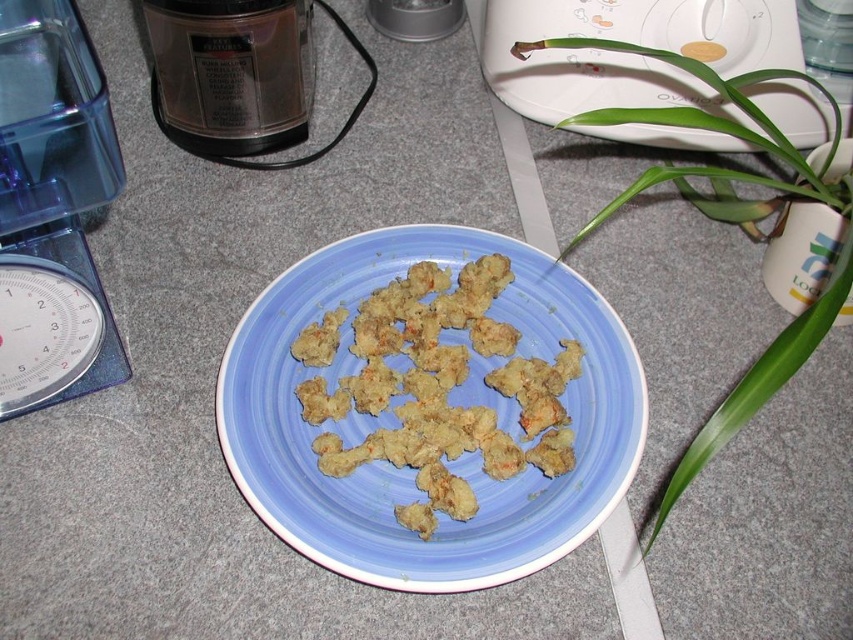
You are organizing items on a kitchen counter and need to place the transparent plastic scale at left and the metallic silver toaster at upper center. According to the image, which item is located to the left of the other?

Answer: The transparent plastic scale at left is positioned on the left side of the metallic silver toaster at upper center, so the transparent plastic scale at left is to the left of the metallic silver toaster at upper center.